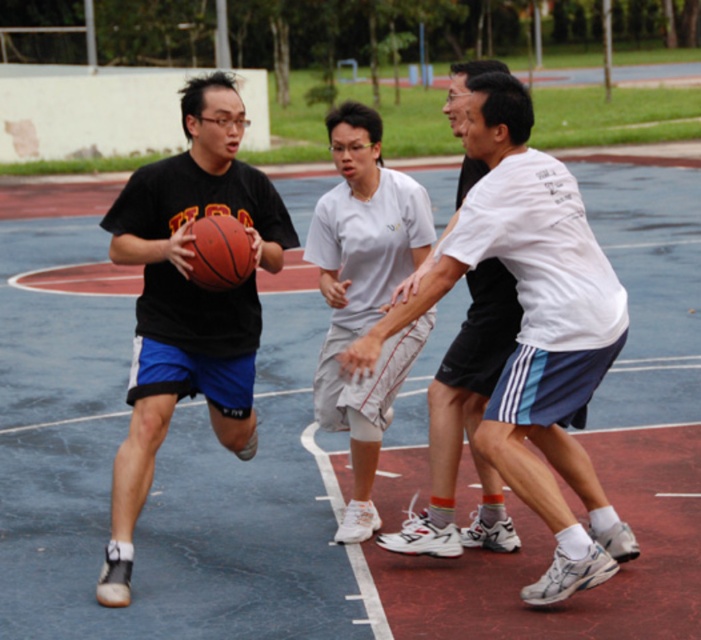
How much distance is there between rubber textured basketball at left and matte black basketball at left?

They are 1.33 meters apart.

Who is positioned more to the right, rubber textured basketball at left or matte black basketball at left?

Positioned to the right is rubber textured basketball at left.

What are the coordinates of `rubber textured basketball at left` in the screenshot? It's located at (526, 328).

Can you confirm if matte black basketball at left is taller than white matte shorts at center?

Correct, matte black basketball at left is much taller as white matte shorts at center.

Does point (158, 294) come behind point (496, 332)?

Yes, point (158, 294) is behind point (496, 332).

Does point (172, 275) come farther from viewer compared to point (449, 109)?

Yes, it is behind point (449, 109).

Find the location of a particular element. The image size is (701, 640). matte black basketball at left is located at coordinates (186, 301).

Does rubber textured basketball at left appear on the right side of white matte shorts at center?

Yes, rubber textured basketball at left is to the right of white matte shorts at center.

Who is more distant from viewer, (x=489, y=163) or (x=447, y=365)?

Point (x=447, y=365)

Measure the distance between point (571, 380) and camera.

The distance of point (571, 380) from camera is 5.49 meters.

Locate an element on the screen. rubber textured basketball at left is located at coordinates (526, 328).